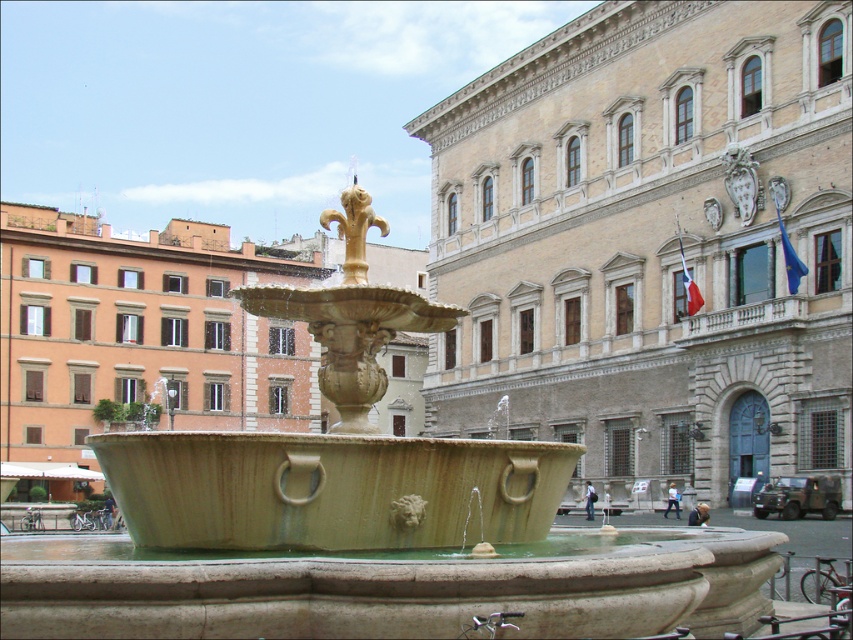
Which of these two, stone fountain at center or gold polished metal fleur-de-lis at center, stands taller?

gold polished metal fleur-de-lis at center is taller.

Is point (331, 579) more distant than point (355, 204)?

That is False.

Between point (424, 522) and point (361, 211), which one is positioned in front?

Positioned in front is point (424, 522).

The image size is (853, 640). What are the coordinates of `stone fountain at center` in the screenshot? It's located at (363, 525).